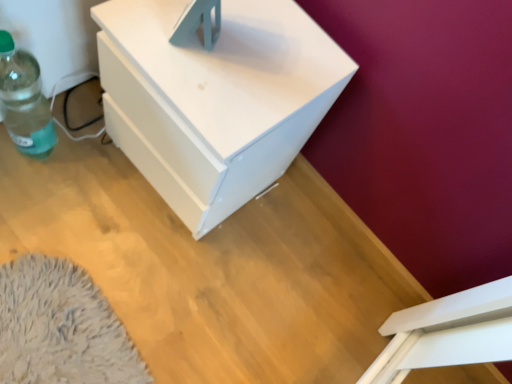
Question: Should I look upward or downward to see green translucent bottle at left?

Choices:
 (A) up
 (B) down

Answer: (A)

Question: Is the depth of green translucent bottle at left greater than that of white matte nightstand at center?

Choices:
 (A) no
 (B) yes

Answer: (B)

Question: Considering the relative sizes of green translucent bottle at left and white matte nightstand at center in the image provided, is green translucent bottle at left thinner than white matte nightstand at center?

Choices:
 (A) no
 (B) yes

Answer: (B)

Question: Considering the relative positions of green translucent bottle at left and white matte nightstand at center in the image provided, is green translucent bottle at left to the right of white matte nightstand at center from the viewer's perspective?

Choices:
 (A) yes
 (B) no

Answer: (B)

Question: Is green translucent bottle at left oriented towards white matte nightstand at center?

Choices:
 (A) yes
 (B) no

Answer: (B)

Question: From a real-world perspective, is green translucent bottle at left physically above white matte nightstand at center?

Choices:
 (A) yes
 (B) no

Answer: (B)

Question: Can we say green translucent bottle at left lies outside white matte nightstand at center?

Choices:
 (A) yes
 (B) no

Answer: (A)

Question: Is white matte nightstand at center outside green translucent bottle at left?

Choices:
 (A) no
 (B) yes

Answer: (B)

Question: Can you confirm if white matte nightstand at center is positioned to the right of green translucent bottle at left?

Choices:
 (A) yes
 (B) no

Answer: (A)

Question: From the image's perspective, does white matte nightstand at center appear higher than green translucent bottle at left?

Choices:
 (A) yes
 (B) no

Answer: (B)

Question: Can you confirm if white matte nightstand at center is bigger than green translucent bottle at left?

Choices:
 (A) no
 (B) yes

Answer: (B)

Question: Is white matte nightstand at center looking in the opposite direction of green translucent bottle at left?

Choices:
 (A) yes
 (B) no

Answer: (B)

Question: Is white matte nightstand at center positioned far away from green translucent bottle at left?

Choices:
 (A) no
 (B) yes

Answer: (A)

Question: Based on their positions, is white matte nightstand at center located to the left or right of green translucent bottle at left?

Choices:
 (A) left
 (B) right

Answer: (B)